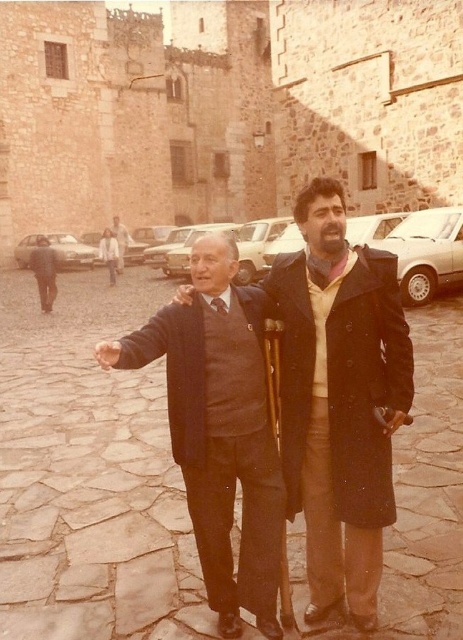
Between dark blue wool coat at center and dark gray coat at center, which one appears on the right side from the viewer's perspective?

From the viewer's perspective, dark blue wool coat at center appears more on the right side.

Is dark blue wool coat at center below dark gray coat at center?

Indeed, dark blue wool coat at center is positioned under dark gray coat at center.

The image size is (463, 640). I want to click on dark blue wool coat at center, so click(x=268, y=406).

This screenshot has width=463, height=640. In order to click on dark blue wool coat at center in this screenshot , I will do `click(268, 406)`.

Does point (277, 502) come closer to viewer compared to point (121, 243)?

Yes, point (277, 502) is in front of point (121, 243).

The width and height of the screenshot is (463, 640). Describe the element at coordinates (268, 406) in the screenshot. I see `dark blue wool coat at center` at that location.

Where is `dark blue wool coat at center`? Image resolution: width=463 pixels, height=640 pixels. dark blue wool coat at center is located at coordinates (268, 406).

Identify the location of dark blue wool coat at center. Image resolution: width=463 pixels, height=640 pixels. (268, 406).

Who is more forward, (17, 252) or (123, 260)?

Point (17, 252) is in front.

Looking at this image, is matte silver sedan at left below matte black coat at center?

Yes, matte silver sedan at left is below matte black coat at center.

Does point (85, 260) lie in front of point (121, 225)?

Yes, point (85, 260) is in front of point (121, 225).

This screenshot has width=463, height=640. I want to click on matte silver sedan at left, so 72,250.